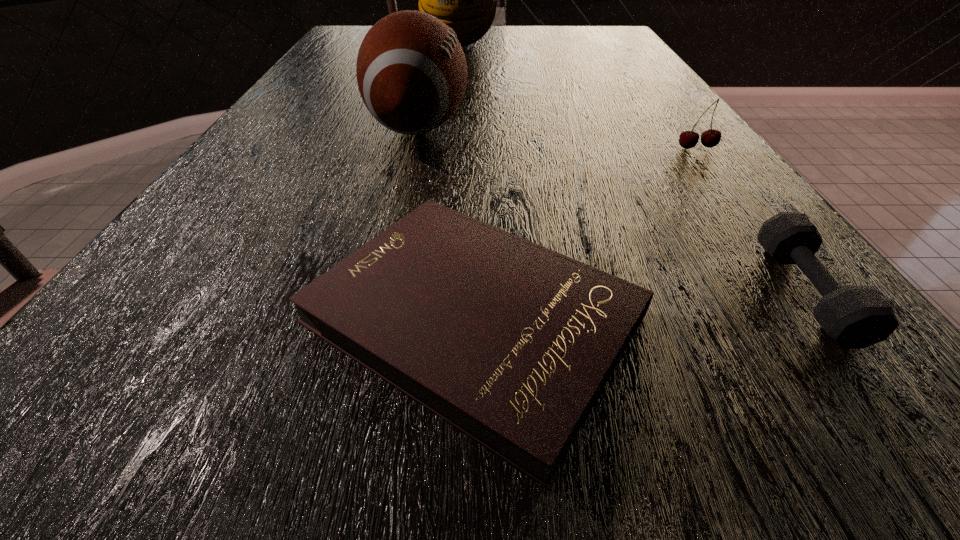
Identify the location of vacant point located between the second shortest object and the cherry. (752, 220).

Locate an element on the screen. vacant area that lies between the third shortest object and the shortest object is located at coordinates (586, 233).

Where is `free point between the dumbbell and the third tallest object`? This screenshot has width=960, height=540. free point between the dumbbell and the third tallest object is located at coordinates (752, 220).

You are a GUI agent. You are given a task and a screenshot of the screen. Output one action in this format:
    pyautogui.click(x=<x>, y=<y>)
    Task: Click on the vacant space in between the third shortest object and the farthest object
    The width and height of the screenshot is (960, 540).
    Given the screenshot: What is the action you would take?
    pyautogui.click(x=578, y=97)

At what (x,y) coordinates should I click in order to perform the action: click on free space between the cherry and the farthest object. Please return your answer as a coordinate pair (x, y). This screenshot has height=540, width=960. Looking at the image, I should click on (578, 97).

Identify the location of unoccupied area between the third shortest object and the shortest object. (586, 233).

Where is `object that ranks as the fourth closest to the football`? This screenshot has height=540, width=960. object that ranks as the fourth closest to the football is located at coordinates (855, 317).

Point out which object is positioned as the fourth nearest to the football. Please provide its 2D coordinates. Your answer should be formatted as a tuple, i.e. [(x, y)], where the tuple contains the x and y coordinates of a point satisfying the conditions above.

[(855, 317)]

Identify the location of free space that satisfies the following two spatial constraints: 1. on the laces of the fourth tallest object; 2. on the left side of the football. (378, 292).

Find the location of a particular element. The image size is (960, 540). blank space that satisfies the following two spatial constraints: 1. on the laces of the football; 2. on the right side of the dumbbell is located at coordinates (378, 292).